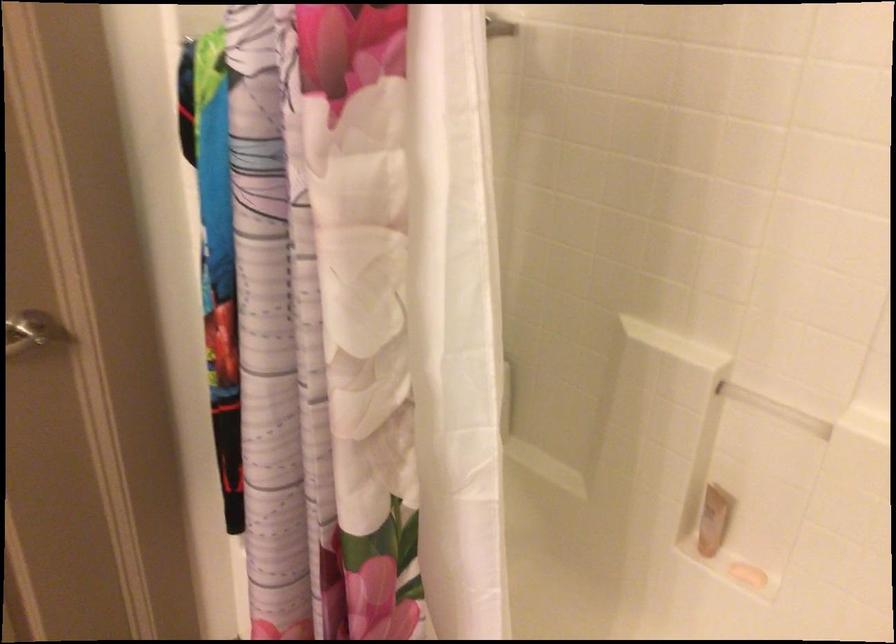
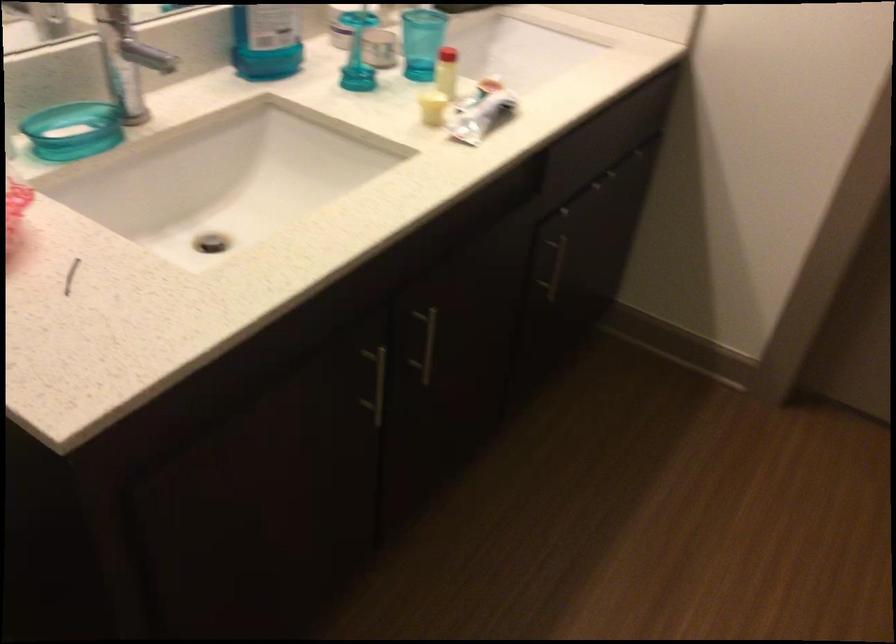
First-person continuous shooting, in which direction is the camera rotating?

The camera's rotation is toward left-down.